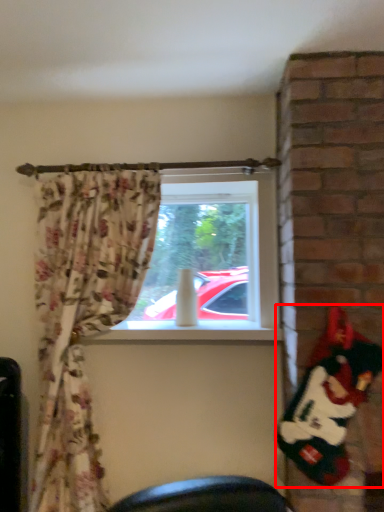
Question: From the image's perspective, what is the correct spatial relationship of santa claus (annotated by the red box) in relation to window screen?

Choices:
 (A) below
 (B) above

Answer: (A)